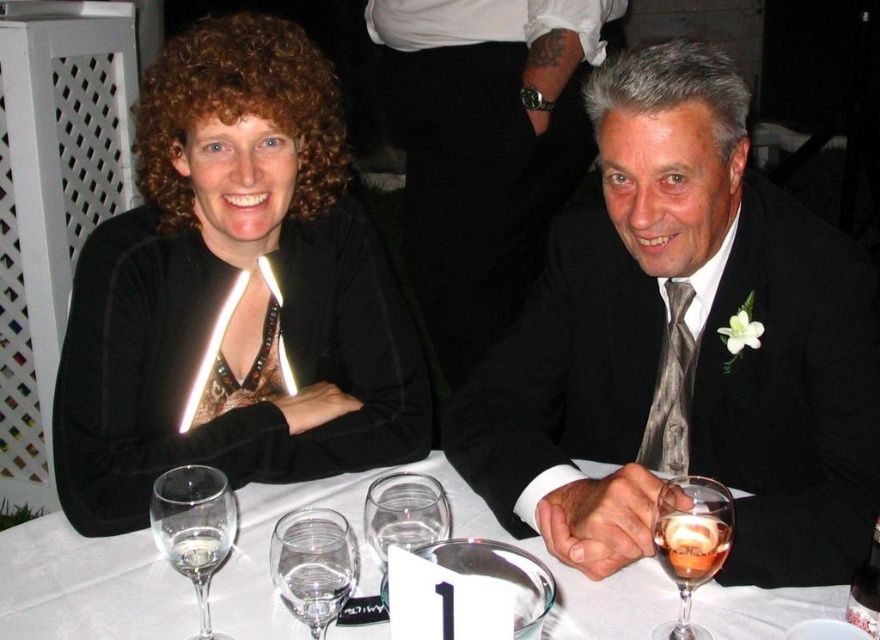
Is shiny black suit at center smaller than transparent glass wine glass at center?

Actually, shiny black suit at center might be larger than transparent glass wine glass at center.

Can you confirm if shiny black suit at center is positioned above transparent glass wine glass at center?

Indeed, shiny black suit at center is positioned over transparent glass wine glass at center.

Which is in front, point (726, 426) or point (408, 518)?

Point (408, 518)

In order to click on shiny black suit at center in this screenshot , I will do `click(682, 348)`.

Is the position of shiny black suit at center less distant than that of translucent glass wine glass at lower right?

No, it is not.

Does shiny black suit at center come behind translucent glass wine glass at lower right?

That is True.

Is point (550, 298) positioned in front of point (665, 486)?

No, (550, 298) is further to viewer.

Locate an element on the screen. Image resolution: width=880 pixels, height=640 pixels. shiny black suit at center is located at coordinates (682, 348).

Which of these two, black satin dress at upper left or clear glass wine at center, stands shorter?

With less height is clear glass wine at center.

The height and width of the screenshot is (640, 880). Find the location of `black satin dress at upper left`. black satin dress at upper left is located at coordinates (229, 289).